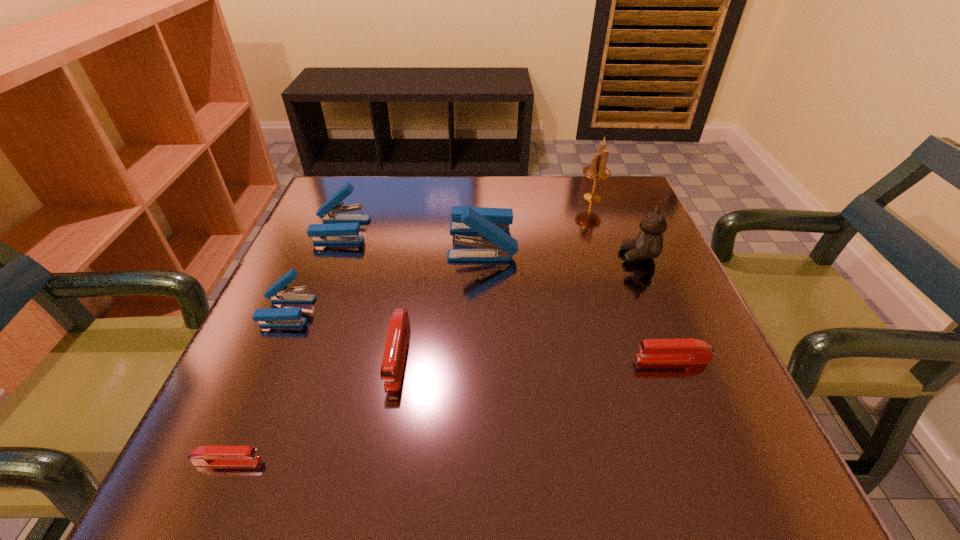
Where is `teddy bear that is at the right edge`? teddy bear that is at the right edge is located at coordinates (648, 245).

Where is `stapler present at the right edge`? This screenshot has width=960, height=540. stapler present at the right edge is located at coordinates (689, 350).

Locate an element on the screen. The height and width of the screenshot is (540, 960). object that is at the far left corner is located at coordinates (344, 228).

The image size is (960, 540). In order to click on object that is at the near left corner in this screenshot , I will do `click(212, 456)`.

You are a GUI agent. You are given a task and a screenshot of the screen. Output one action in this format:
    pyautogui.click(x=<x>, y=<y>)
    Task: Click on the object located in the far right corner section of the desktop
    
    Given the screenshot: What is the action you would take?
    pos(597,170)

At what (x,y) coordinates should I click in order to perform the action: click on free space at the far edge of the desktop. Please return your answer as a coordinate pair (x, y). This screenshot has width=960, height=540. Looking at the image, I should click on pos(555,187).

Where is `free location at the near edge`? free location at the near edge is located at coordinates (487, 461).

In the image, there is a desktop. Find the location of `vacant space at the left edge`. vacant space at the left edge is located at coordinates (354, 281).

The width and height of the screenshot is (960, 540). In the image, there is a desktop. Identify the location of blank space at the right edge. (714, 339).

The width and height of the screenshot is (960, 540). In order to click on vacant region at the far right corner of the desktop in this screenshot , I will do `click(628, 181)`.